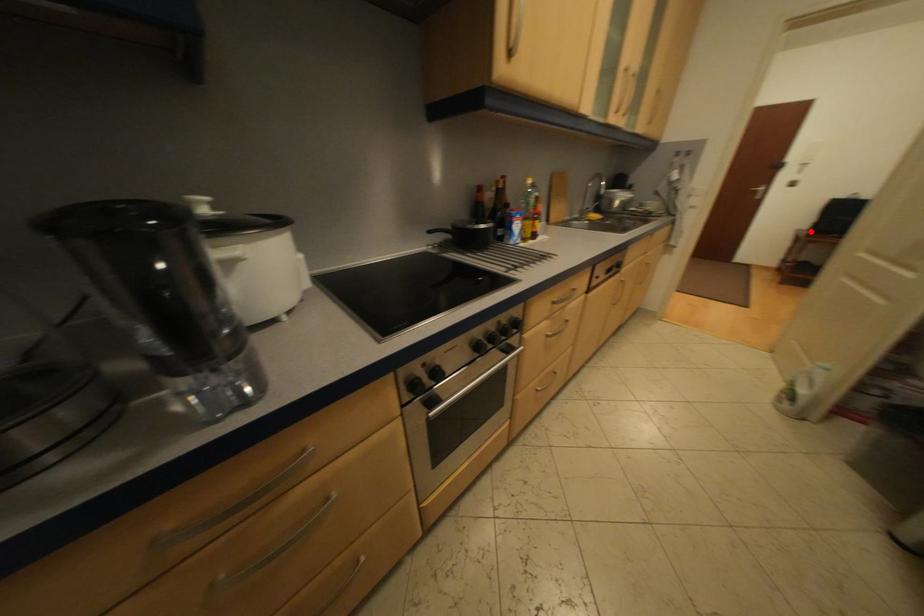
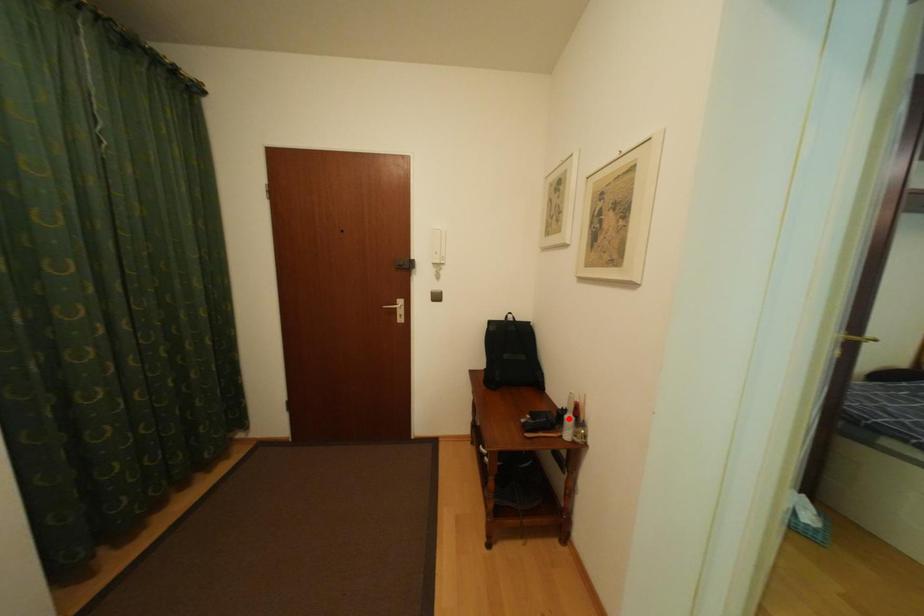
I am providing you with two images of the same scene from different viewpoints. A red point is marked on the first image and another point is marked on the second image. Do the highlighted points in image1 and image2 indicate the same real-world spot?

No